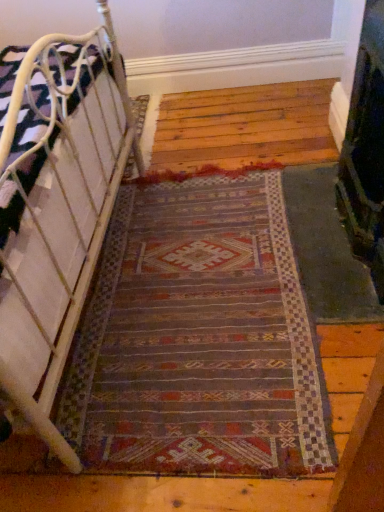
Question: In terms of width, does multicolored woven rug at center look wider or thinner when compared to white metal bed at left?

Choices:
 (A) thin
 (B) wide

Answer: (B)

Question: In the image, is multicolored woven rug at center positioned in front of or behind white metal bed at left?

Choices:
 (A) behind
 (B) front

Answer: (A)

Question: Which is farther from the dark green textured fireplace at right?

Choices:
 (A) multicolored woven rug at center
 (B) white metal bed at left

Answer: (B)

Question: Based on their relative distances, which object is farther from the white metal bed at left?

Choices:
 (A) dark green textured fireplace at right
 (B) multicolored woven rug at center

Answer: (A)